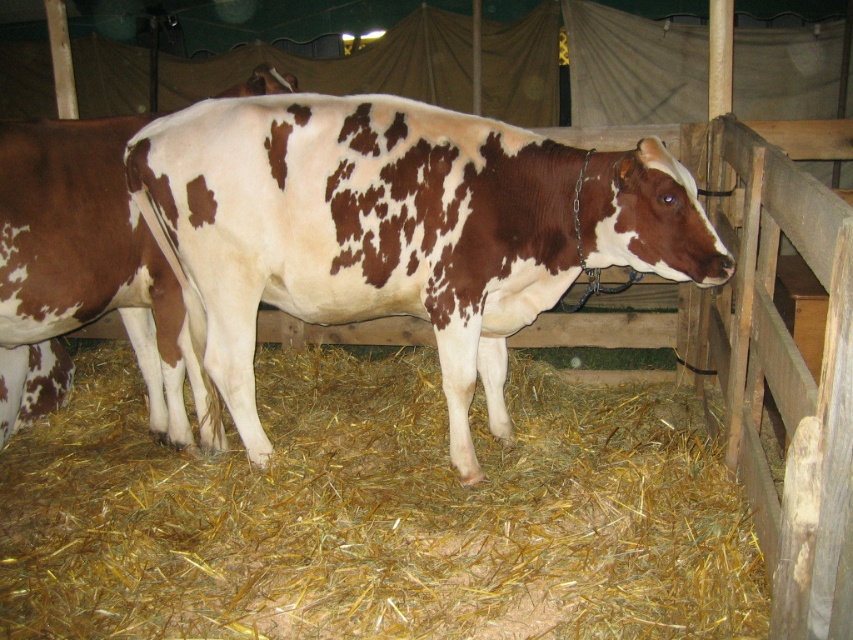
Question: Can you confirm if yellow straw at lower center is positioned to the right of brown spotted cow at center?

Choices:
 (A) no
 (B) yes

Answer: (A)

Question: Is yellow straw at lower center bigger than brown spotted cow at center?

Choices:
 (A) yes
 (B) no

Answer: (A)

Question: Which point is closer to the camera taking this photo?

Choices:
 (A) (380, 621)
 (B) (317, 218)

Answer: (A)

Question: Does yellow straw at lower center appear on the right side of brown spotted cow at center?

Choices:
 (A) no
 (B) yes

Answer: (A)

Question: Which point appears farthest from the camera in this image?

Choices:
 (A) (418, 257)
 (B) (251, 472)

Answer: (B)